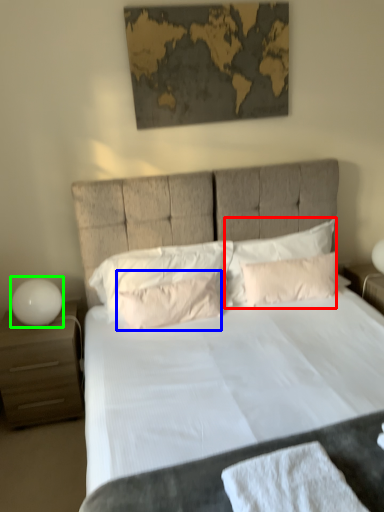
Question: Which object is positioned closest to pillow (highlighted by a red box)? Select from pillow (highlighted by a blue box) and table lamp (highlighted by a green box).

Choices:
 (A) pillow
 (B) table lamp

Answer: (A)